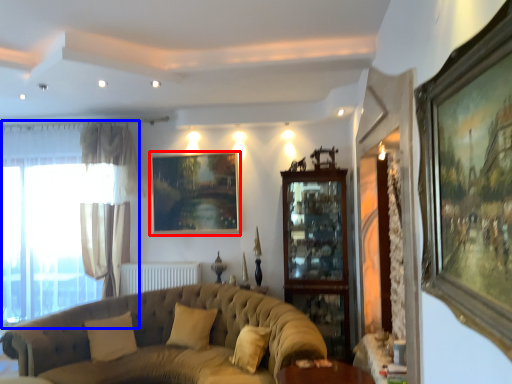
Question: Which object appears closest to the camera in this image, picture frame (highlighted by a red box) or window (highlighted by a blue box)?

Choices:
 (A) picture frame
 (B) window

Answer: (B)